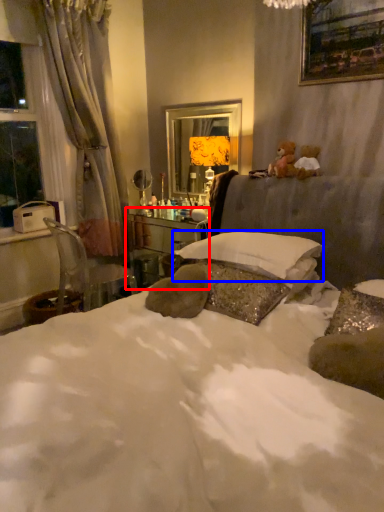
Question: Which object appears closest to the camera in this image, vanity (highlighted by a red box) or pillow (highlighted by a blue box)?

Choices:
 (A) vanity
 (B) pillow

Answer: (B)